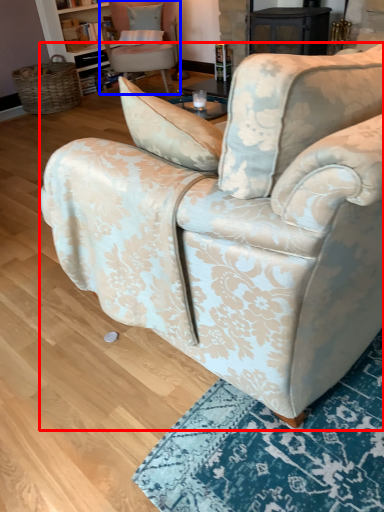
Question: Which of the following is the closest to the observer, chair (highlighted by a red box) or chair (highlighted by a blue box)?

Choices:
 (A) chair
 (B) chair

Answer: (A)